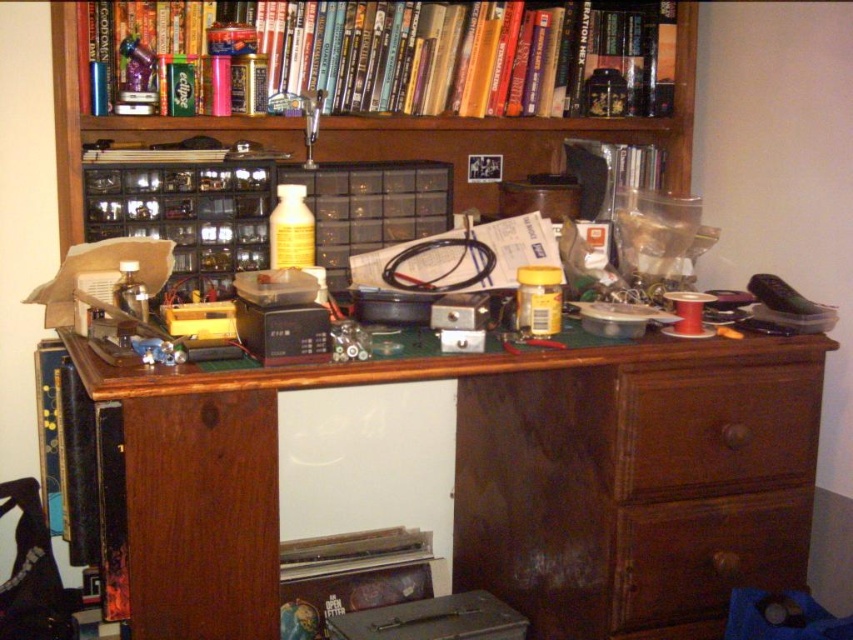
Which is behind, point (519, 141) or point (622, 564)?

Point (519, 141)

Is point (262, 138) farther from viewer compared to point (660, 504)?

That is True.

Is point (65, 38) positioned after point (686, 584)?

No, it is in front of (686, 584).

This screenshot has width=853, height=640. I want to click on wooden bookcase at upper center, so click(519, 134).

Is hardcover book at upper center in front of wooden drawer at lower right?

No, it is behind wooden drawer at lower right.

Which of these two, hardcover book at upper center or wooden drawer at lower right, stands taller?

Standing taller between the two is hardcover book at upper center.

At what (x,y) coordinates should I click in order to perform the action: click on hardcover book at upper center. Please return your answer as a coordinate pair (x, y). The height and width of the screenshot is (640, 853). Looking at the image, I should click on (451, 56).

At what (x,y) coordinates should I click in order to perform the action: click on hardcover book at upper center. Please return your answer as a coordinate pair (x, y). Image resolution: width=853 pixels, height=640 pixels. Looking at the image, I should click on (451, 56).

Which of these two, wooden desk at center or yellow matte bottle at center, stands taller?

wooden desk at center

This screenshot has width=853, height=640. What are the coordinates of `wooden desk at center` in the screenshot? It's located at (497, 480).

At what (x,y) coordinates should I click in order to perform the action: click on wooden desk at center. Please return your answer as a coordinate pair (x, y). Image resolution: width=853 pixels, height=640 pixels. Looking at the image, I should click on tap(497, 480).